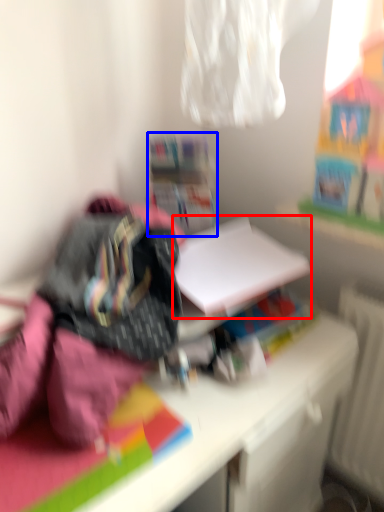
Question: Which point is further to the camera, paperback book (highlighted by a red box) or shelf (highlighted by a blue box)?

Choices:
 (A) paperback book
 (B) shelf

Answer: (B)